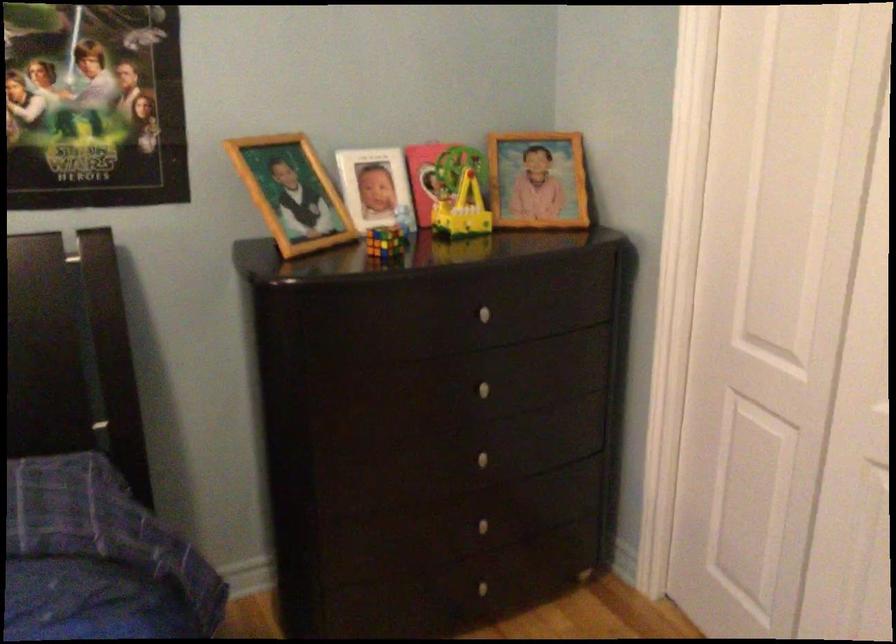
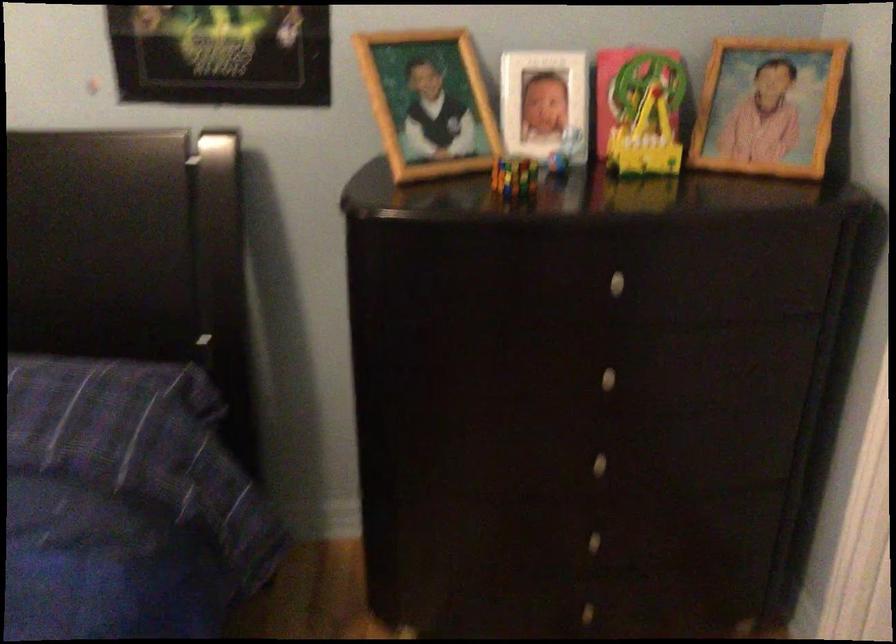
The images are taken continuously from a first-person perspective. In which direction are you moving?

The cameraman moved toward right, forward.